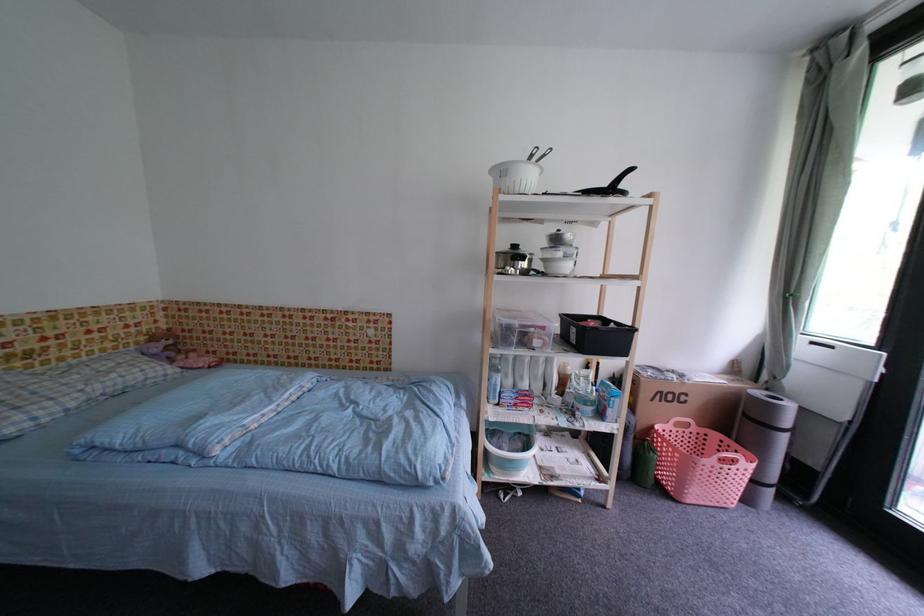
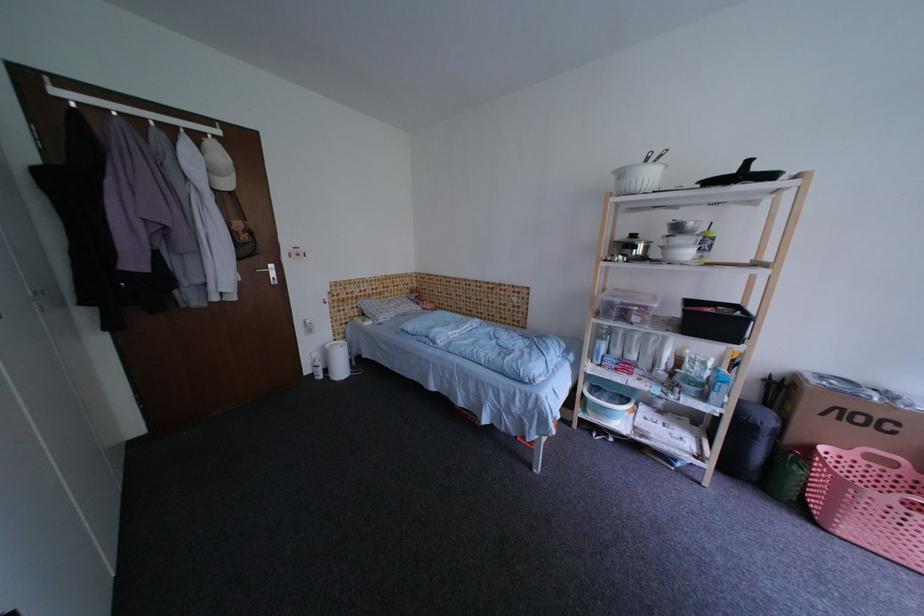
Where in the second image is the point corresponding to the point at 686,427 from the first image?

(878, 459)